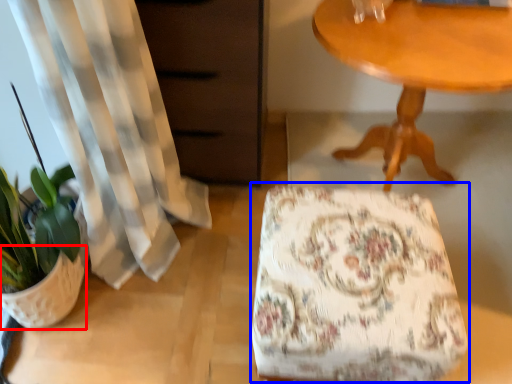
Question: Which of the following is the farthest to the observer, flowerpot (highlighted by a red box) or rocking chair (highlighted by a blue box)?

Choices:
 (A) flowerpot
 (B) rocking chair

Answer: (A)